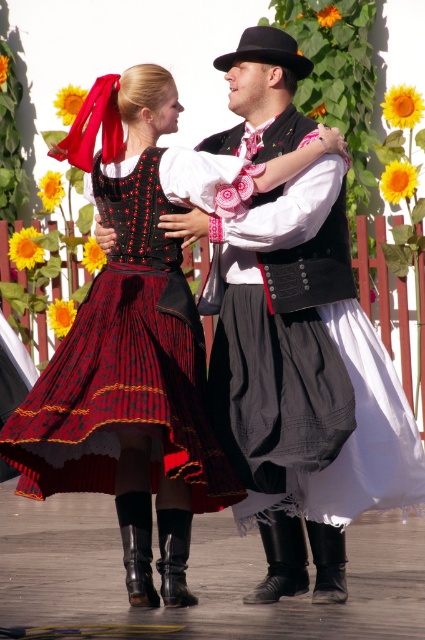
Question: Based on their relative distances, which object is farther from the matte black skirt at center?

Choices:
 (A) rich burgundy velvet skirt at center
 (B) black velvet vest at center

Answer: (B)

Question: Which point is closer to the camera?

Choices:
 (A) matte black skirt at center
 (B) black velvet vest at center

Answer: (A)

Question: Is the position of black velvet vest at center less distant than that of rich burgundy velvet skirt at center?

Choices:
 (A) yes
 (B) no

Answer: (B)

Question: Which object is farther from the camera taking this photo?

Choices:
 (A) rich burgundy velvet skirt at center
 (B) matte black skirt at center

Answer: (B)

Question: Is matte black skirt at center above rich burgundy velvet skirt at center?

Choices:
 (A) yes
 (B) no

Answer: (A)

Question: Does matte black skirt at center appear on the right side of black velvet vest at center?

Choices:
 (A) no
 (B) yes

Answer: (A)